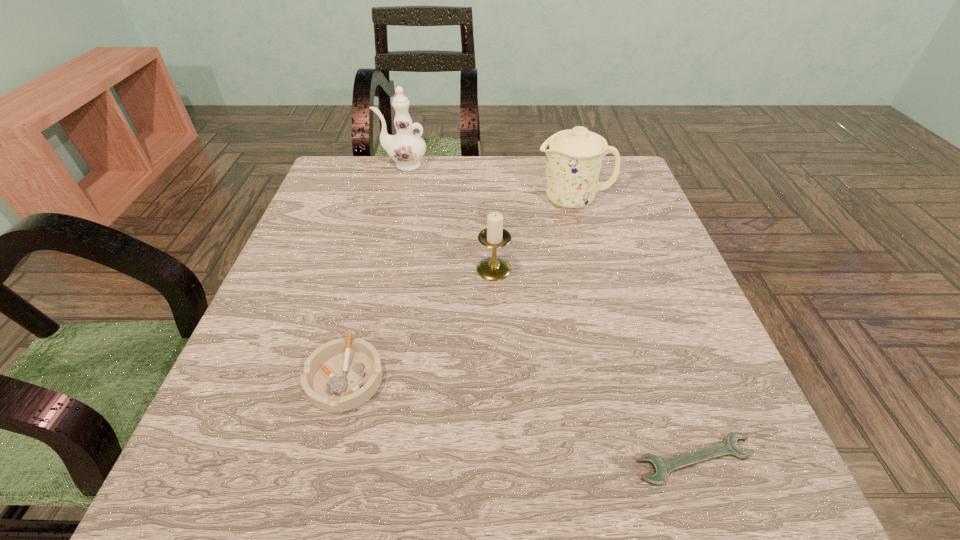
What are the coordinates of `chinaware that is positioned at the left edge` in the screenshot? It's located at (406, 148).

Locate an element on the screen. The height and width of the screenshot is (540, 960). ashtray located in the left edge section of the desktop is located at coordinates (340, 375).

Locate an element on the screen. This screenshot has width=960, height=540. chinaware at the right edge is located at coordinates (573, 157).

In order to click on wrench positioned at the right edge in this screenshot , I will do `click(662, 467)`.

At what (x,y) coordinates should I click in order to perform the action: click on object present at the far left corner. Please return your answer as a coordinate pair (x, y). This screenshot has width=960, height=540. Looking at the image, I should click on (406, 148).

Find the location of a particular element. object at the far right corner is located at coordinates (573, 157).

The width and height of the screenshot is (960, 540). I want to click on object present at the near right corner, so click(662, 467).

You are a GUI agent. You are given a task and a screenshot of the screen. Output one action in this format:
    pyautogui.click(x=<x>, y=<y>)
    Task: Click on the vacant point at the far edge
    
    Given the screenshot: What is the action you would take?
    pyautogui.click(x=392, y=163)

Identify the location of vacant space at the near edge of the desktop. (376, 483).

The height and width of the screenshot is (540, 960). What are the coordinates of `free space at the left edge of the desktop` in the screenshot? It's located at (359, 231).